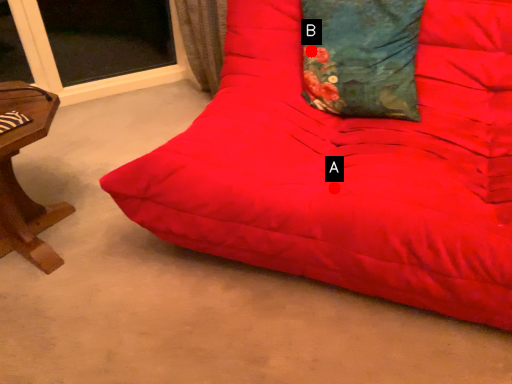
Question: Two points are circled on the image, labeled by A and B beside each circle. Which point is closer to the camera?

Choices:
 (A) A is closer
 (B) B is closer

Answer: (A)